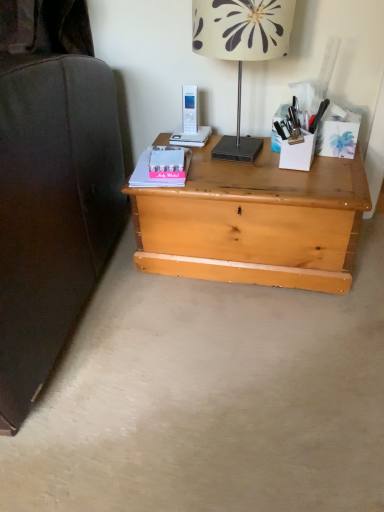
Question: Is white plastic phone at upper center oriented away from pink matte paperback book at center, placed as the 2th paperback book when sorted from front to back?

Choices:
 (A) no
 (B) yes

Answer: (A)

Question: Is white plastic phone at upper center positioned in front of pink matte paperback book at center, the first paperback book when ordered from back to front?

Choices:
 (A) yes
 (B) no

Answer: (B)

Question: Is white plastic phone at upper center further to the viewer compared to pink matte paperback book at center, the first paperback book when ordered from back to front?

Choices:
 (A) yes
 (B) no

Answer: (A)

Question: Considering the relative sizes of white plastic phone at upper center and pink matte paperback book at center, the first paperback book when ordered from back to front, in the image provided, is white plastic phone at upper center shorter than pink matte paperback book at center, the first paperback book when ordered from back to front,?

Choices:
 (A) no
 (B) yes

Answer: (A)

Question: Does white plastic phone at upper center have a greater height compared to pink matte paperback book at center, the first paperback book when ordered from back to front?

Choices:
 (A) no
 (B) yes

Answer: (B)

Question: Considering the positions of white floral lampshade at upper center and pink matte paperback book at center, placed as the 2th paperback book when sorted from front to back, in the image, is white floral lampshade at upper center taller or shorter than pink matte paperback book at center, placed as the 2th paperback book when sorted from front to back,?

Choices:
 (A) tall
 (B) short

Answer: (A)

Question: Looking at their shapes, would you say white floral lampshade at upper center is wider or thinner than pink matte paperback book at center, placed as the 2th paperback book when sorted from front to back?

Choices:
 (A) wide
 (B) thin

Answer: (A)

Question: Is point (278, 10) positioned closer to the camera than point (162, 157)?

Choices:
 (A) farther
 (B) closer

Answer: (B)

Question: Looking at the image, does white floral lampshade at upper center seem bigger or smaller compared to pink matte paperback book at center, the first paperback book when ordered from back to front?

Choices:
 (A) big
 (B) small

Answer: (A)

Question: Is point (145, 152) closer or farther from the camera than point (180, 154)?

Choices:
 (A) closer
 (B) farther

Answer: (B)

Question: From their relative heights in the image, would you say matte pink paperback book at center, which is the first paperback book in front-to-back order, is taller or shorter than pink matte paperback book at center, placed as the 2th paperback book when sorted from front to back?

Choices:
 (A) tall
 (B) short

Answer: (B)

Question: Do you think matte pink paperback book at center, the second paperback book from the back, is within pink matte paperback book at center, placed as the 2th paperback book when sorted from front to back, or outside of it?

Choices:
 (A) inside
 (B) outside

Answer: (B)

Question: Considering their positions, is matte pink paperback book at center, the second paperback book from the back, located in front of or behind pink matte paperback book at center, placed as the 2th paperback book when sorted from front to back?

Choices:
 (A) front
 (B) behind

Answer: (A)

Question: In the image, is light wood chest at center positioned in front of or behind white plastic phone at upper center?

Choices:
 (A) front
 (B) behind

Answer: (A)

Question: Is light wood chest at center wider or thinner than white plastic phone at upper center?

Choices:
 (A) thin
 (B) wide

Answer: (B)